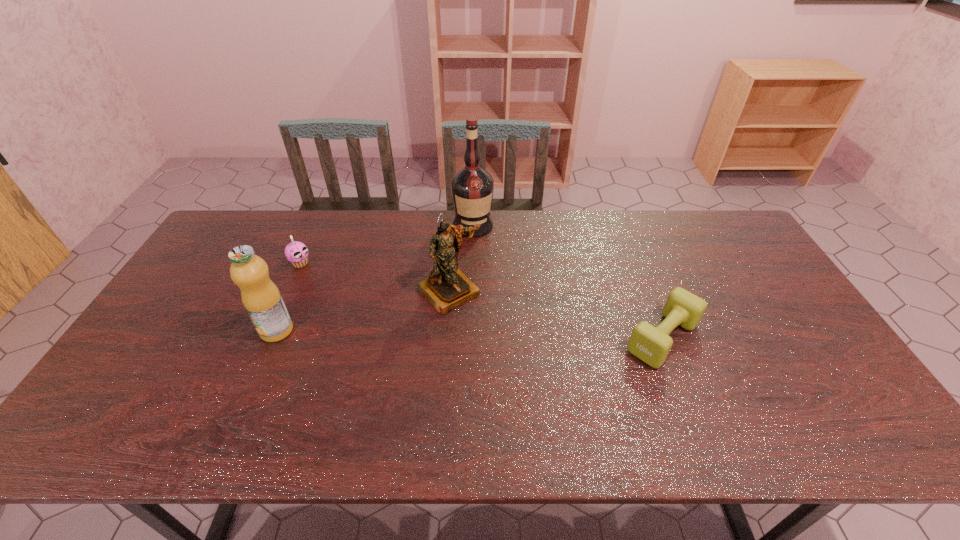
Where is `free point between the figurine and the tallest object`? This screenshot has height=540, width=960. free point between the figurine and the tallest object is located at coordinates (462, 258).

What are the coordinates of `free area in between the farthest object and the dumbbell` in the screenshot? It's located at (567, 281).

Locate an element on the screen. free spot between the fruit juice and the figurine is located at coordinates (363, 310).

I want to click on free space between the fruit juice and the cupcake, so click(x=289, y=296).

This screenshot has height=540, width=960. I want to click on free spot between the figurine and the dumbbell, so click(x=556, y=314).

This screenshot has width=960, height=540. Identify the location of vacant region between the figurine and the cupcake. (375, 277).

Identify which object is the closest to the farthest object. Please provide its 2D coordinates. Your answer should be formatted as a tuple, i.e. [(x, y)], where the tuple contains the x and y coordinates of a point satisfying the conditions above.

[(447, 287)]

You are a GUI agent. You are given a task and a screenshot of the screen. Output one action in this format:
    pyautogui.click(x=<x>, y=<y>)
    Task: Click on the object that can be found as the fourth closest to the farthest object
    The width and height of the screenshot is (960, 540).
    Given the screenshot: What is the action you would take?
    (261, 298)

Image resolution: width=960 pixels, height=540 pixels. I want to click on vacant space that satisfies the following two spatial constraints: 1. on the front side of the shortest object; 2. on the right side of the farthest object, so click(471, 338).

You are a GUI agent. You are given a task and a screenshot of the screen. Output one action in this format:
    pyautogui.click(x=<x>, y=<y>)
    Task: Click on the vacant region that satisfies the following two spatial constraints: 1. on the front side of the rightmost object; 2. on the right side of the figurine
    
    Given the screenshot: What is the action you would take?
    446,338